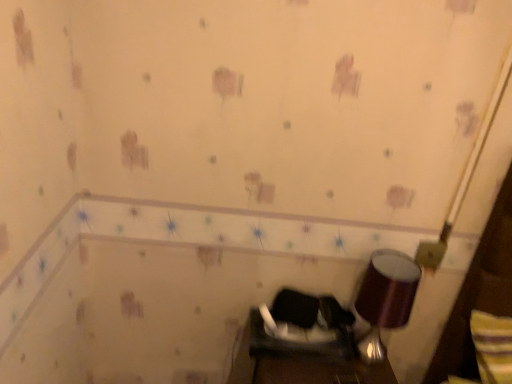
Question: Is shiny metallic lampshade at lower right inside or outside of black fabric swivel chair at center?

Choices:
 (A) inside
 (B) outside

Answer: (B)

Question: From a real-world perspective, is shiny metallic lampshade at lower right physically located above or below black fabric swivel chair at center?

Choices:
 (A) above
 (B) below

Answer: (A)

Question: Is point (360, 357) positioned closer to the camera than point (290, 336)?

Choices:
 (A) farther
 (B) closer

Answer: (A)

Question: From a real-world perspective, relative to shiny metallic lampshade at lower right, is black fabric swivel chair at center vertically above or below?

Choices:
 (A) below
 (B) above

Answer: (A)

Question: Is black fabric swivel chair at center in front of or behind shiny metallic lampshade at lower right in the image?

Choices:
 (A) behind
 (B) front

Answer: (A)

Question: Is black fabric swivel chair at center inside or outside of shiny metallic lampshade at lower right?

Choices:
 (A) inside
 (B) outside

Answer: (B)

Question: Looking at the image, does black fabric swivel chair at center seem bigger or smaller compared to shiny metallic lampshade at lower right?

Choices:
 (A) big
 (B) small

Answer: (B)